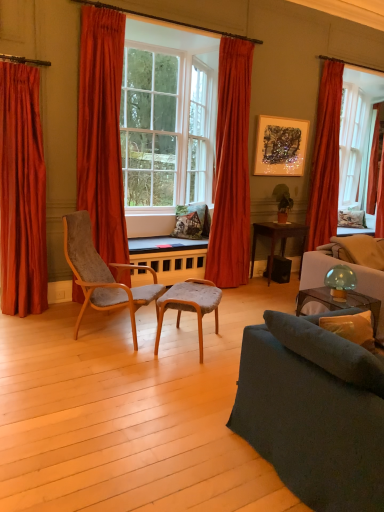
The height and width of the screenshot is (512, 384). Describe the element at coordinates (315, 267) in the screenshot. I see `velvet blue couch at right` at that location.

Locate an element on the screen. The image size is (384, 512). velvet grey chair at center, marked as the 1th chair in a right-to-left arrangement is located at coordinates (189, 305).

What do you see at coordinates (340, 282) in the screenshot? The image size is (384, 512). I see `translucent glass mushroom at upper right` at bounding box center [340, 282].

Where is `translucent glass mushroom at upper right`? translucent glass mushroom at upper right is located at coordinates (340, 282).

The height and width of the screenshot is (512, 384). Identify the location of yellow fabric pillow at lower right, the 1th pillow viewed from the left. (352, 328).

Measure the distance between velvet grey chair at left, which appears as the 2th chair when viewed from the right, and camera.

The distance of velvet grey chair at left, which appears as the 2th chair when viewed from the right, from camera is 11.05 feet.

This screenshot has width=384, height=512. I want to click on velvet blue couch at right, so click(315, 267).

Is velvet orange curtain at left, which is the 2th curtain in left-to-right order, looking in the opposite direction of white fabric pillow at upper right, acting as the 1th pillow starting from the back?

No, velvet orange curtain at left, which is the 2th curtain in left-to-right order,'s orientation is not away from white fabric pillow at upper right, acting as the 1th pillow starting from the back.

Which is more to the left, velvet orange curtain at left, which is the 2th curtain in left-to-right order, or white fabric pillow at upper right, acting as the 1th pillow starting from the back?

velvet orange curtain at left, which is the 2th curtain in left-to-right order, is more to the left.

Which object is closer to the camera taking this photo, velvet orange curtain at left, the 4th curtain when ordered from right to left, or white fabric pillow at upper right, which appears as the second pillow when viewed from the left?

velvet orange curtain at left, the 4th curtain when ordered from right to left, is more forward.

Can you confirm if translucent glass mushroom at upper right is bigger than clear glass window at center?

No.

Is translucent glass mushroom at upper right completely or partially outside of clear glass window at center?

Absolutely, translucent glass mushroom at upper right is external to clear glass window at center.

Is translucent glass mushroom at upper right at the left side of clear glass window at center?

In fact, translucent glass mushroom at upper right is to the right of clear glass window at center.

Which object is more forward, velvet blue couch at right or dark gray fabric couch at lower right?

dark gray fabric couch at lower right is closer to the camera.

Considering the sizes of velvet blue couch at right and dark gray fabric couch at lower right in the image, is velvet blue couch at right bigger or smaller than dark gray fabric couch at lower right?

Clearly, velvet blue couch at right is larger in size than dark gray fabric couch at lower right.

Does point (329, 267) appear closer or farther from the camera than point (313, 346)?

Point (329, 267) is farther from the camera than point (313, 346).

The height and width of the screenshot is (512, 384). In order to click on couch located behind the dark gray fabric couch at lower right in this screenshot , I will do `click(315, 267)`.

Considering the relative sizes of velvet orange curtain at right, placed as the fourth curtain when sorted from left to right, and velvet grey chair at left, the first chair viewed from the left, in the image provided, is velvet orange curtain at right, placed as the fourth curtain when sorted from left to right, taller than velvet grey chair at left, the first chair viewed from the left,?

Yes, velvet orange curtain at right, placed as the fourth curtain when sorted from left to right, is taller than velvet grey chair at left, the first chair viewed from the left.

From a real-world perspective, is velvet orange curtain at right, placed as the fourth curtain when sorted from left to right, below velvet grey chair at left, the first chair viewed from the left?

No.

Is velvet orange curtain at right, placed as the fourth curtain when sorted from left to right, located outside velvet grey chair at left, which appears as the 2th chair when viewed from the right?

Yes, velvet orange curtain at right, placed as the fourth curtain when sorted from left to right, is located beyond the bounds of velvet grey chair at left, which appears as the 2th chair when viewed from the right.

Is velvet orange curtain at right, which ranks as the second curtain in right-to-left order, positioned with its back to velvet grey chair at left, the first chair viewed from the left?

No, velvet orange curtain at right, which ranks as the second curtain in right-to-left order, is not facing away from velvet grey chair at left, the first chair viewed from the left.

From the image's perspective, which pillow is the 2nd one below the green matte plant at center? Please provide its 2D coordinates.

[(352, 328)]

Which point is more distant from viewer, (278, 192) or (342, 316)?

The point (278, 192) is more distant.

Are green matte plant at center and yellow fabric pillow at lower right, which is the 2th pillow in back-to-front order, located far from each other?

That's right, there is a large distance between green matte plant at center and yellow fabric pillow at lower right, which is the 2th pillow in back-to-front order.

Could you measure the distance between green matte plant at center and yellow fabric pillow at lower right, which ranks as the 1th pillow in bottom-to-top order?

They are 3.28 meters apart.

The height and width of the screenshot is (512, 384). Find the location of `houseplant on the left of orange velvet curtain at right, the 5th curtain in the left-to-right sequence`. houseplant on the left of orange velvet curtain at right, the 5th curtain in the left-to-right sequence is located at coordinates (282, 201).

Is green matte plant at center completely or partially outside of orange velvet curtain at right, the 5th curtain in the left-to-right sequence?

That's correct, green matte plant at center is outside of orange velvet curtain at right, the 5th curtain in the left-to-right sequence.

Considering the positions of objects green matte plant at center and orange velvet curtain at right, which appears as the 1th curtain when viewed from the right, in the image provided, who is in front, green matte plant at center or orange velvet curtain at right, which appears as the 1th curtain when viewed from the right,?

green matte plant at center.

From the image's perspective, does green matte plant at center appear lower than orange velvet curtain at right, which appears as the 1th curtain when viewed from the right?

Correct, green matte plant at center appears lower than orange velvet curtain at right, which appears as the 1th curtain when viewed from the right, in the image.

Which is in front, point (139, 65) or point (136, 308)?

Positioned in front is point (136, 308).

This screenshot has width=384, height=512. In order to click on the 1st chair below when counting from the clear glass window at center (from the image's perspective) in this screenshot , I will do `click(102, 274)`.

Does clear glass window at center turn towards velvet grey chair at left, which appears as the 2th chair when viewed from the right?

No.

From the image's perspective, which curtain is the 1st one above the white fabric pillow at upper right, acting as the 1th pillow starting from the back? Please provide its 2D coordinates.

[(101, 130)]

You are a GUI agent. You are given a task and a screenshot of the screen. Output one action in this format:
    pyautogui.click(x=<x>, y=<y>)
    Task: Click on the lamp below the clear glass window at center (from the image's perspective)
    The image size is (384, 512).
    Given the screenshot: What is the action you would take?
    click(x=340, y=282)

Estimate the real-world distances between objects in this image. Which object is closer to velvet blue couch at right, translucent glass mushroom at upper right or velvet orange curtain at left, the 4th curtain when ordered from right to left?

translucent glass mushroom at upper right.

When comparing their distances from metallic textured artwork at upper center, does dark brown wooden table at center, the 2th table positioned from the left, or green matte plant at center seem closer?

green matte plant at center is positioned closer to the anchor metallic textured artwork at upper center.

Estimate the real-world distances between objects in this image. Which object is further from velvet orange curtain at center, placed as the third curtain when sorted from left to right, satin red curtain at left, which is counted as the 5th curtain, starting from the right, or dark gray fabric couch at lower right?

dark gray fabric couch at lower right is further to velvet orange curtain at center, placed as the third curtain when sorted from left to right.

Looking at the image, which one is located further to velvet grey chair at center, marked as the 1th chair in a right-to-left arrangement, yellow fabric pillow at lower right, which is the 2th pillow in back-to-front order, or metallic textured artwork at upper center?

A: metallic textured artwork at upper center.

Which object lies nearer to the anchor point green matte plant at center, velvet grey chair at left, the first chair viewed from the left, or wooden table at center, positioned as the first table in left-to-right order?

The object closer to green matte plant at center is wooden table at center, positioned as the first table in left-to-right order.

Which object lies nearer to the anchor point velvet orange curtain at left, which is the 2th curtain in left-to-right order, translucent glass mushroom at upper right or velvet orange curtain at right, placed as the fourth curtain when sorted from left to right?

translucent glass mushroom at upper right.

Based on the photo, which object lies nearer to the anchor point velvet grey chair at left, the first chair viewed from the left, metallic textured artwork at upper center or green matte plant at center?

metallic textured artwork at upper center.

Looking at the image, which one is located closer to dark brown wooden table at center, the first table from the right, clear glass window at center or wooden table at center, the second table from the right?

The object closer to dark brown wooden table at center, the first table from the right, is wooden table at center, the second table from the right.

Image resolution: width=384 pixels, height=512 pixels. Identify the location of table situated between wooden table at center, positioned as the first table in left-to-right order, and green matte plant at center from left to right. (278, 239).

At what (x,y) coordinates should I click in order to perform the action: click on curtain situated between wooden table at center, positioned as the first table in left-to-right order, and dark brown wooden table at center, the 2th table positioned from the left, from left to right. Please return your answer as a coordinate pair (x, y). Image resolution: width=384 pixels, height=512 pixels. Looking at the image, I should click on (231, 168).

Locate an element on the screen. houseplant situated between velvet grey chair at center, which is the 2th chair from left to right, and orange velvet curtain at right, which appears as the 1th curtain when viewed from the right, from left to right is located at coordinates [282, 201].

This screenshot has height=512, width=384. I want to click on houseplant between velvet orange curtain at left, the 4th curtain when ordered from right to left, and velvet blue couch at right from left to right, so click(282, 201).